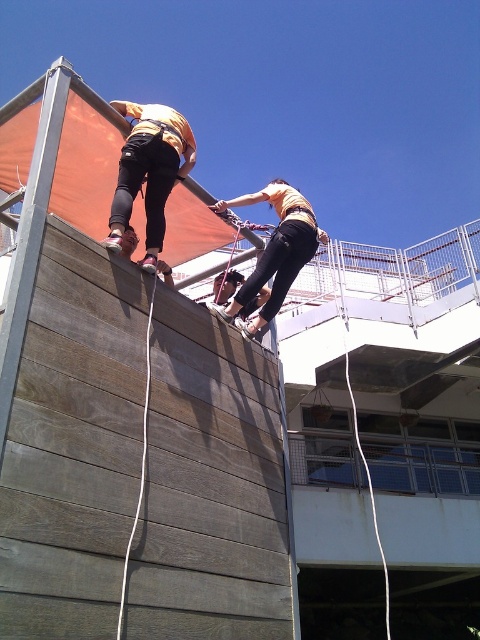
Question: Which of the following is the farthest from the observer?

Choices:
 (A) (257, 195)
 (B) (180, 131)

Answer: (A)

Question: Which of the following is the closest to the observer?

Choices:
 (A) matte black pants at upper left
 (B) matte yellow shirt at center

Answer: (A)

Question: Is matte black pants at upper left further to the viewer compared to matte yellow shirt at center?

Choices:
 (A) no
 (B) yes

Answer: (A)

Question: Can you confirm if matte black pants at upper left is positioned to the left of matte yellow shirt at center?

Choices:
 (A) yes
 (B) no

Answer: (A)

Question: Is matte black pants at upper left to the right of matte yellow shirt at center from the viewer's perspective?

Choices:
 (A) no
 (B) yes

Answer: (A)